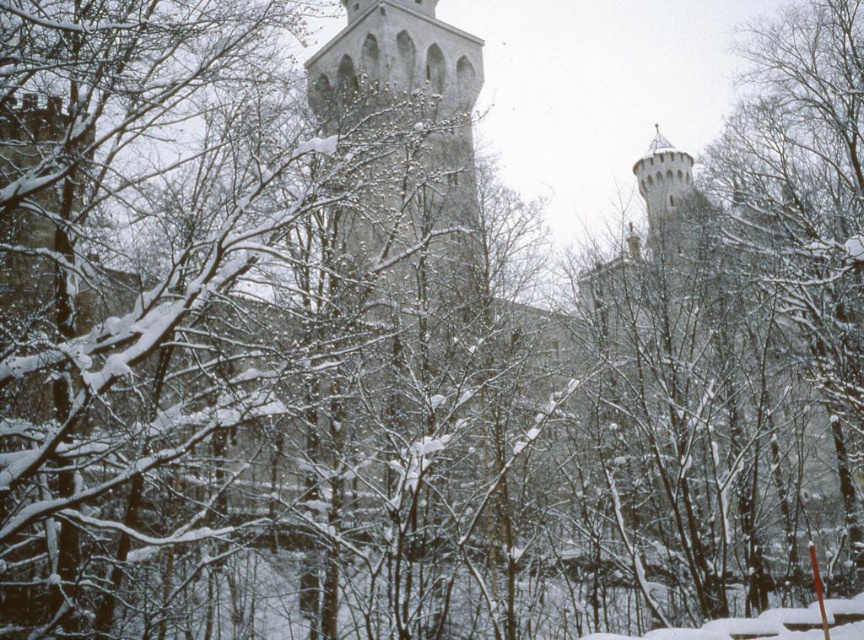
The height and width of the screenshot is (640, 864). What do you see at coordinates (805, 205) in the screenshot?
I see `snow-covered branches at right` at bounding box center [805, 205].

Find the location of a particular element. This screenshot has height=640, width=864. snow-covered branches at right is located at coordinates (805, 205).